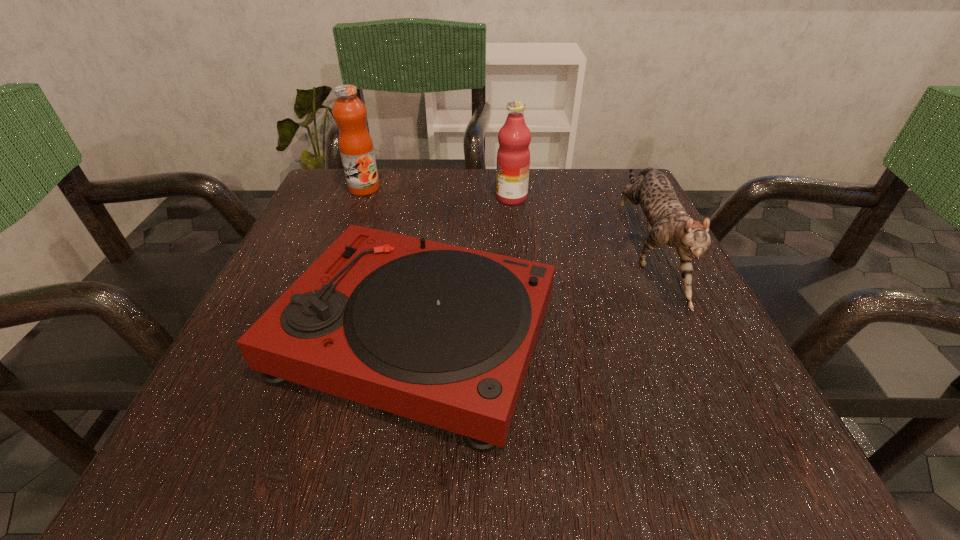
Identify the location of free space located 0.230m on the right of the record player. (705, 335).

This screenshot has width=960, height=540. In order to click on cat present at the far edge in this screenshot , I will do `click(668, 223)`.

The width and height of the screenshot is (960, 540). Find the location of `object at the near edge`. object at the near edge is located at coordinates (442, 334).

The image size is (960, 540). I want to click on fruit juice positioned at the left edge, so click(356, 148).

Identify the location of record player at the left edge. The width and height of the screenshot is (960, 540). [x=442, y=334].

The height and width of the screenshot is (540, 960). In order to click on object positioned at the right edge in this screenshot , I will do `click(668, 223)`.

The width and height of the screenshot is (960, 540). Identify the location of object positioned at the far left corner. (356, 148).

The image size is (960, 540). I want to click on object at the near left corner, so click(x=442, y=334).

Locate an element on the screen. object present at the far right corner is located at coordinates (668, 223).

You are a GUI agent. You are given a task and a screenshot of the screen. Output one action in this format:
    pyautogui.click(x=<x>, y=<y>)
    Task: Click on the vacant space at the far edge of the desktop
    Image resolution: width=960 pixels, height=540 pixels.
    Given the screenshot: What is the action you would take?
    pyautogui.click(x=458, y=170)